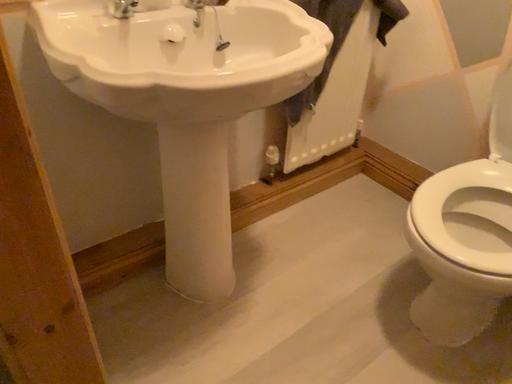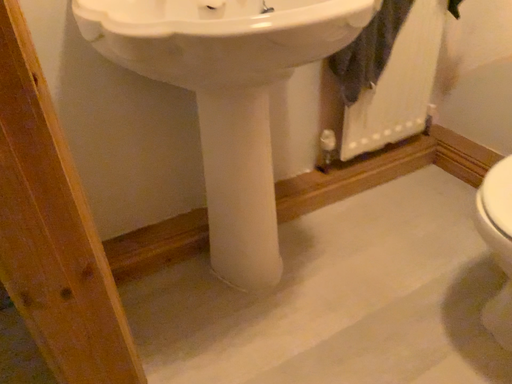
Question: How did the camera likely rotate when shooting the video?

Choices:
 (A) rotated left
 (B) rotated right

Answer: (A)